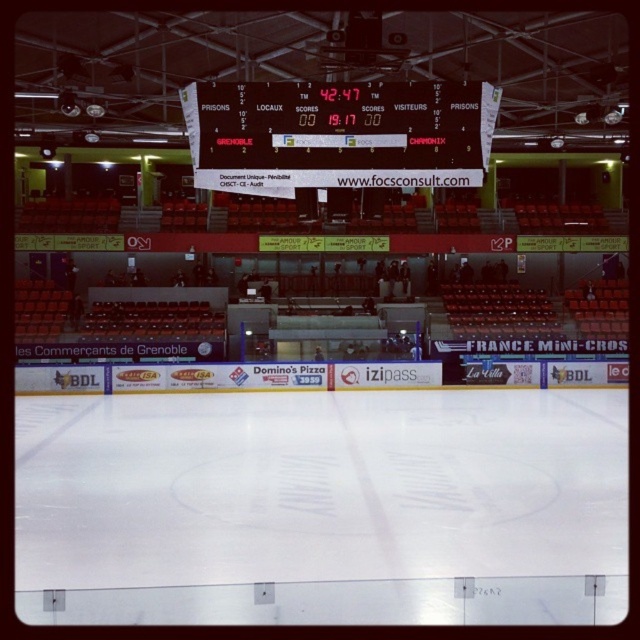
You are an ice hockey player standing at the point labeled as point [323,506]. What surface are you currently standing on?

The point labeled as point [323,506] corresponds to white smooth ice at center, so you are standing on the white smooth ice at center.

You are a spectator at the indoor ice hockey rink. You want to take a photo of the wooden scoreboard at center without the white smooth ice at center blocking the view. Is this possible?

The white smooth ice at center is in front of the wooden scoreboard at center, so taking a photo of the wooden scoreboard at center without the white smooth ice at center blocking the view would require positioning yourself behind the white smooth ice at center or using a different angle to avoid the obstruction.